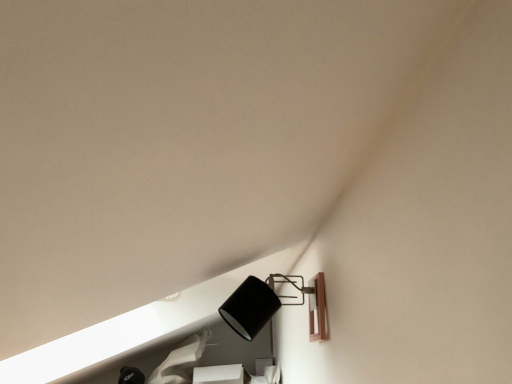
Measure the distance between matte black lampshade at upper right and camera.

The distance of matte black lampshade at upper right from camera is 1.15 meters.

Describe the element at coordinates (250, 307) in the screenshot. I see `matte black lampshade at upper right` at that location.

Locate an element on the screen. matte black lampshade at upper right is located at coordinates (250, 307).

At what (x,y) coordinates should I click in order to perform the action: click on matte black lampshade at upper right. Please return your answer as a coordinate pair (x, y). Looking at the image, I should click on (250, 307).